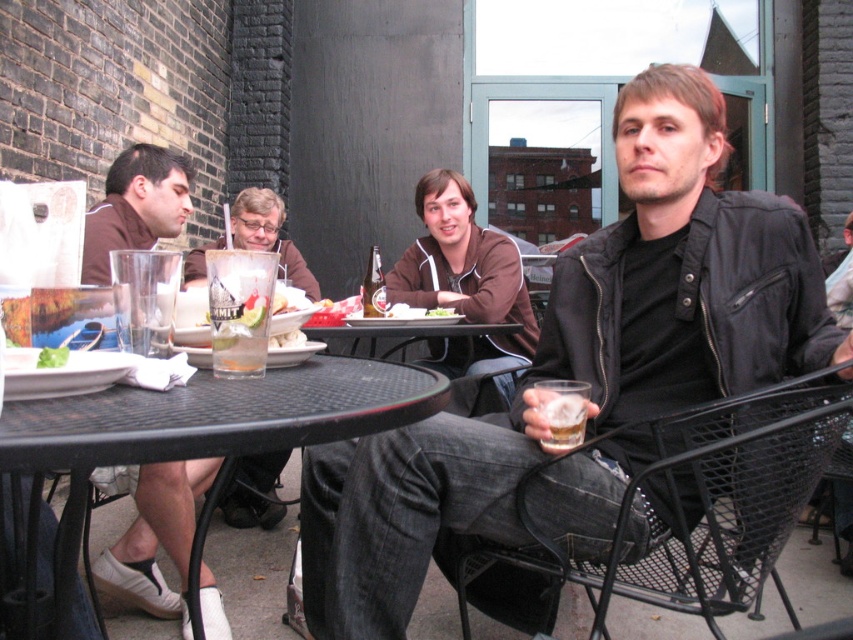
Which is behind, point (408, 262) or point (262, 234)?

Point (408, 262)

Who is positioned more to the right, brown fleece jacket at center or clear glass at center?

Positioned to the right is brown fleece jacket at center.

Which is behind, point (463, 225) or point (254, 227)?

Positioned behind is point (254, 227).

What are the coordinates of `brown fleece jacket at center` in the screenshot? It's located at (463, 280).

In the scene shown: Who is more distant from viewer, (456, 444) or (375, 296)?

The point (375, 296) is more distant.

Does black leather jacket at center have a greater height compared to clear glass beer at center?

Yes, black leather jacket at center is taller than clear glass beer at center.

Where is `black leather jacket at center`? black leather jacket at center is located at coordinates (582, 358).

This screenshot has width=853, height=640. What do you see at coordinates (582, 358) in the screenshot?
I see `black leather jacket at center` at bounding box center [582, 358].

Which is behind, point (361, 474) or point (260, 193)?

The point (260, 193) is more distant.

Image resolution: width=853 pixels, height=640 pixels. I want to click on black leather jacket at center, so click(582, 358).